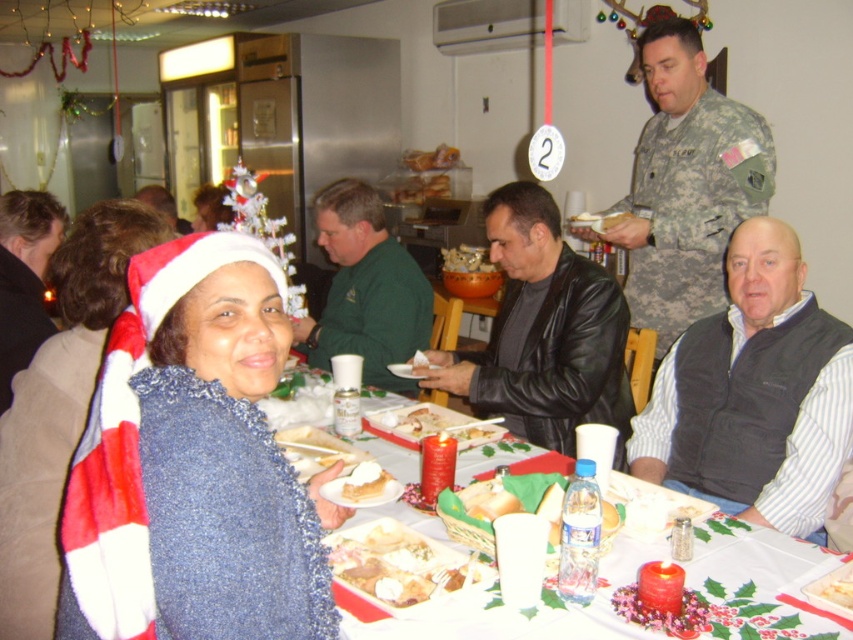
Based on the coordinates provided, what is the object located at point (543, 332) in the image?

The object located at point (543, 332) is the black leather jacket at center.

You are a guest at the holiday gathering and want to reach both the golden brown bread at center and the white bread at table. The server reminds you that the serving utensils are only 20 inches long. Can you use the same utensil to reach both breads without moving the utensil?

The distance between the golden brown bread at center and the white bread at table is 23.63 inches. Since the utensils are only 20 inches long, you cannot reach both breads with the same utensil without moving it.

You are a guest at the holiday party and need to place your black leather jacket at center on a table. However, there is a white paper plate at lower left already on the table. Can you place your jacket on the table without moving the plate?

The black leather jacket at center is much taller than the white paper plate at lower left. Since the jacket is taller, placing it on the table might cause the plate to be displaced or the jacket to hang over the edge, so it would be better to move the plate first.